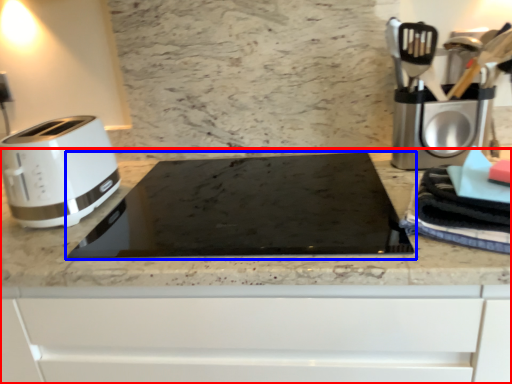
Question: Which of the following is the closest to the observer, countertop (highlighted by a red box) or home appliance (highlighted by a blue box)?

Choices:
 (A) countertop
 (B) home appliance

Answer: (A)